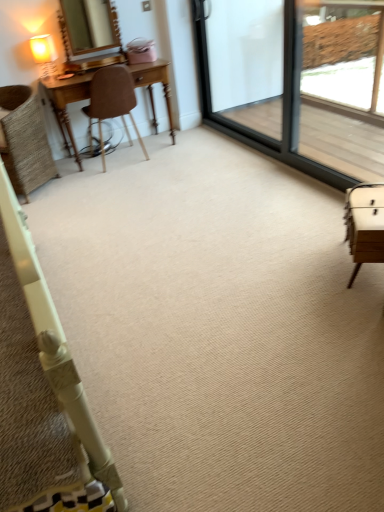
Where is `vacant area that lies to the right of wooden desk at left`? vacant area that lies to the right of wooden desk at left is located at coordinates (200, 146).